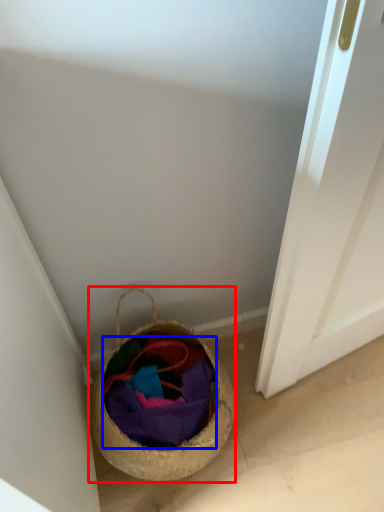
Question: Which point is closer to the camera, basket (highlighted by a red box) or fabric (highlighted by a blue box)?

Choices:
 (A) basket
 (B) fabric

Answer: (A)